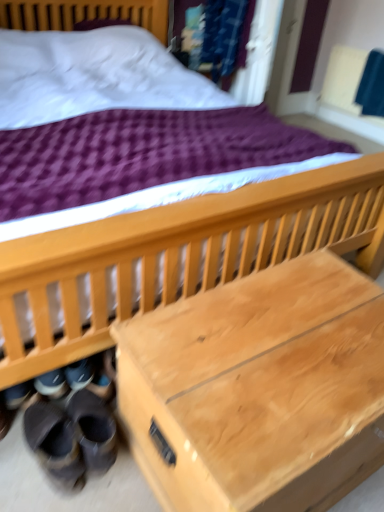
At what (x,y) coordinates should I click in order to perform the action: click on vacant area on top of natural wood trunk at lower center (from a real-world perspective). Please return your answer as a coordinate pair (x, y). The height and width of the screenshot is (512, 384). Looking at the image, I should click on (295, 337).